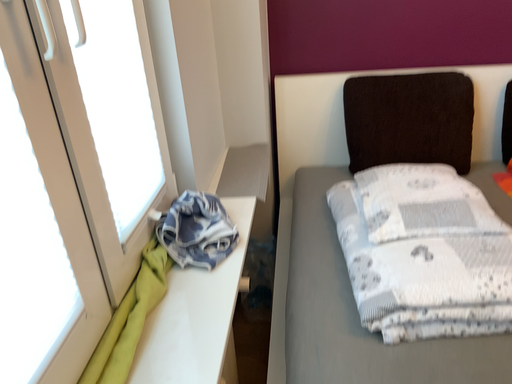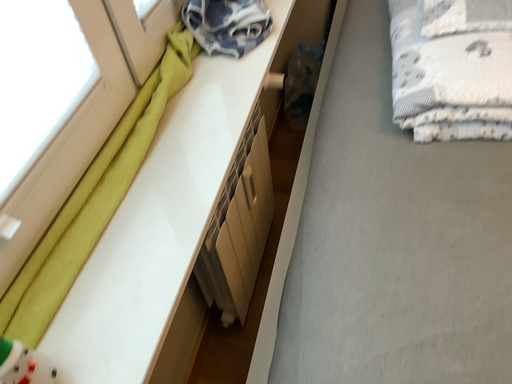
Question: Which way did the camera rotate in the video?

Choices:
 (A) rotated left
 (B) rotated right

Answer: (A)